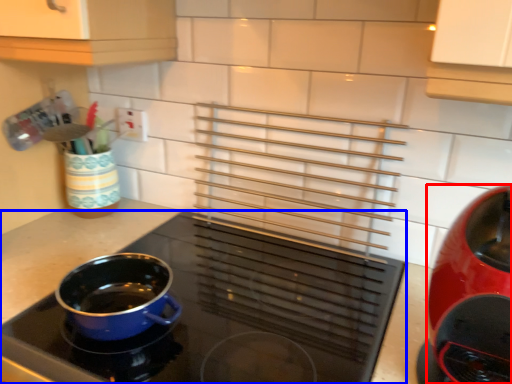
Question: Which object appears farthest to the camera in this image, kitchen appliance (highlighted by a red box) or kitchen appliance (highlighted by a blue box)?

Choices:
 (A) kitchen appliance
 (B) kitchen appliance

Answer: (A)